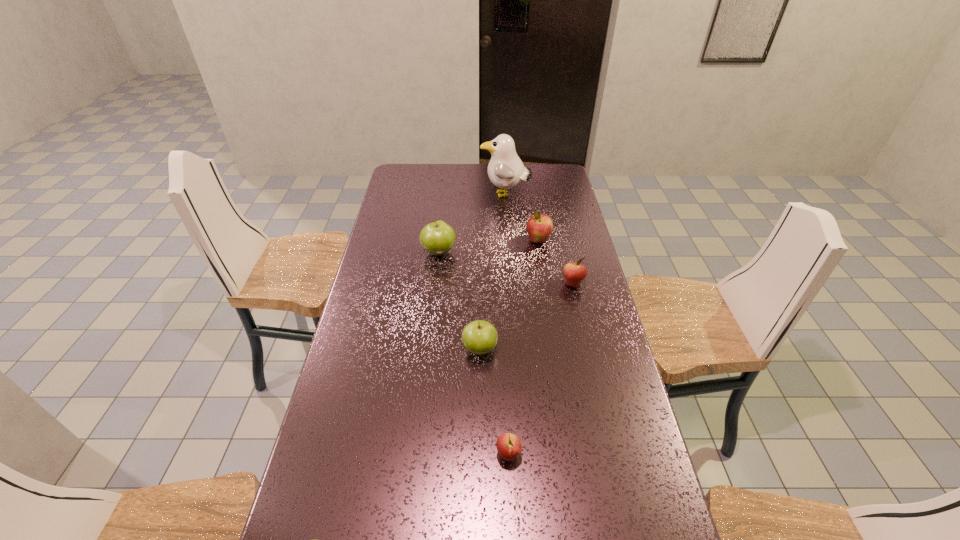
Identify the location of the nearest red apple. This screenshot has width=960, height=540. (509, 446).

Where is `the leftmost red apple`? the leftmost red apple is located at coordinates (509, 446).

What are the coordinates of `vacant region located 0.170m on the beak of the white gull` in the screenshot? It's located at (443, 195).

Find the location of a particular element. blank space located 0.100m on the beak of the white gull is located at coordinates (458, 195).

This screenshot has height=540, width=960. Find the location of `free space located 0.310m on the beak of the white gull`. free space located 0.310m on the beak of the white gull is located at coordinates (411, 195).

At what (x,y) coordinates should I click in order to perform the action: click on blank space located 0.060m on the front of the biggest red apple. Please return your answer as a coordinate pair (x, y). The width and height of the screenshot is (960, 540). Looking at the image, I should click on (541, 259).

Where is `free point located on the back of the fifth apple from right to left`? This screenshot has width=960, height=540. free point located on the back of the fifth apple from right to left is located at coordinates (444, 214).

This screenshot has width=960, height=540. Find the location of `free location located 0.180m on the front of the rightmost red apple`. free location located 0.180m on the front of the rightmost red apple is located at coordinates (584, 332).

In order to click on free space located on the back of the rightmost green apple in this screenshot , I will do `click(480, 293)`.

This screenshot has height=540, width=960. What are the coordinates of `free space located on the back of the sixth farthest object` in the screenshot? It's located at (502, 330).